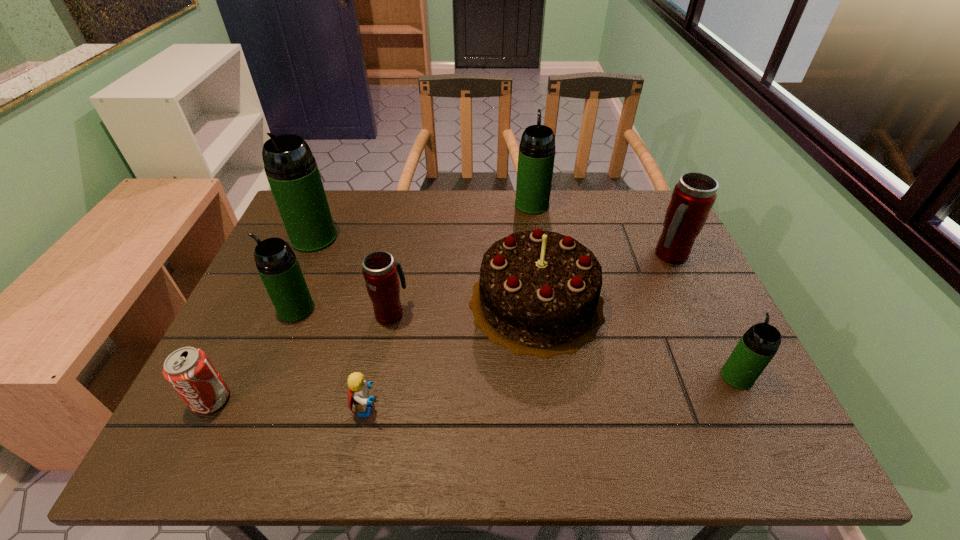
Locate an element on the screen. This screenshot has height=540, width=960. the smaller red thermos bottle is located at coordinates (380, 271).

The width and height of the screenshot is (960, 540). Find the location of `the left red thermos bottle`. the left red thermos bottle is located at coordinates (380, 271).

What are the coordinates of `soda can` in the screenshot? It's located at point(188,370).

The height and width of the screenshot is (540, 960). What are the coordinates of `the eighth tallest object` in the screenshot? It's located at (188, 370).

The image size is (960, 540). In order to click on Lego in this screenshot , I will do `click(358, 393)`.

In order to click on free space located from the spout of the third nearest green thermos bottle in this screenshot , I will do `click(295, 282)`.

Find the location of `free spot located 0.180m on the side with the handle of the farther red thermos bottle`. free spot located 0.180m on the side with the handle of the farther red thermos bottle is located at coordinates (701, 319).

This screenshot has height=540, width=960. I want to click on vacant space located on the right of the brown birthday cake, so click(695, 303).

Find the location of `vacant space situated 0.100m from the spout of the rightmost green thermos bottle`. vacant space situated 0.100m from the spout of the rightmost green thermos bottle is located at coordinates (x=714, y=329).

Where is `vacant area situated from the spout of the rightmost green thermos bottle`? vacant area situated from the spout of the rightmost green thermos bottle is located at coordinates (701, 302).